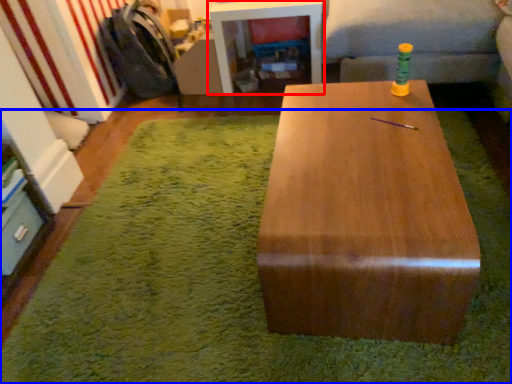
Question: Which object appears farthest to the camera in this image, table (highlighted by a red box) or mat (highlighted by a blue box)?

Choices:
 (A) table
 (B) mat

Answer: (A)